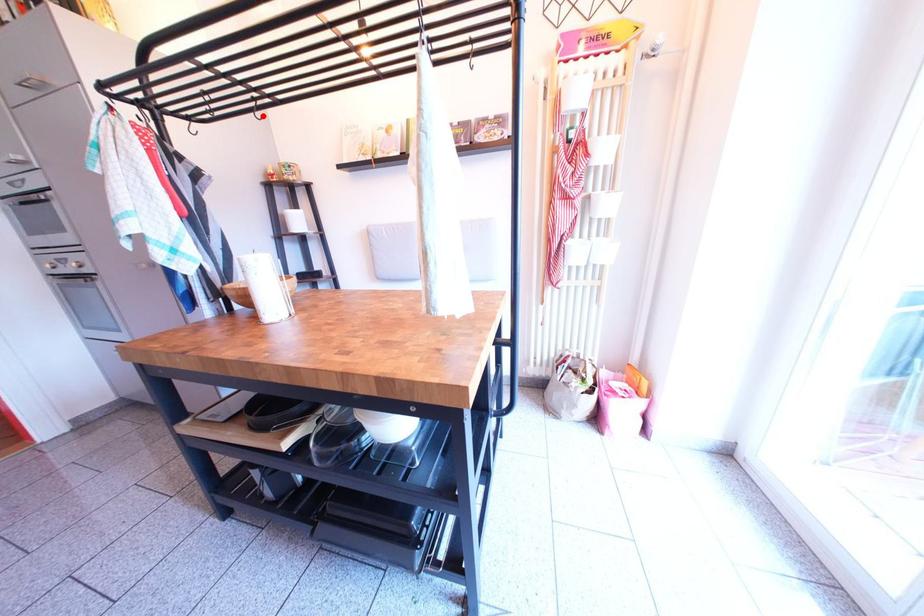
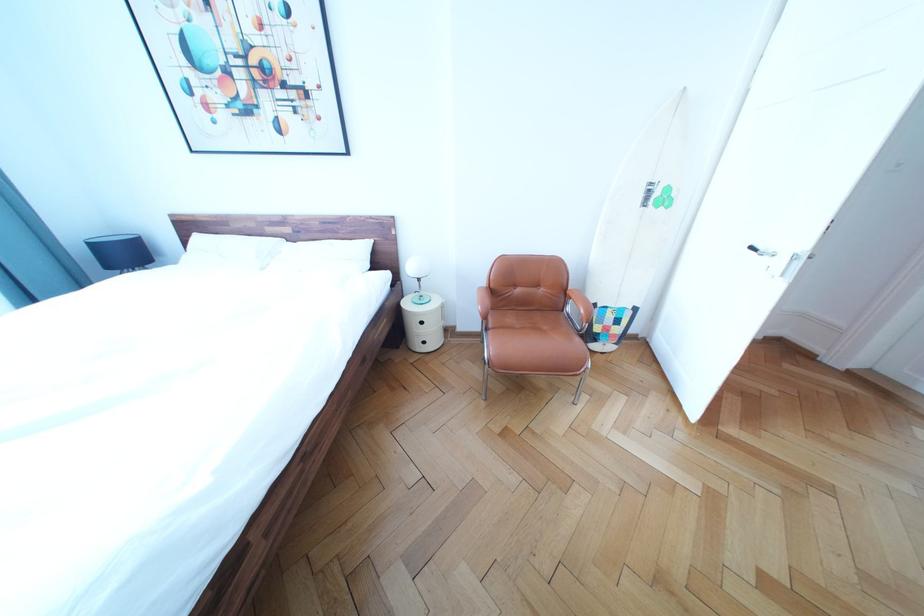
Question: I am providing you with two images of the same scene from different viewpoints. A red point is marked on the first image. Can you still see the location of the red point in image 2?

Choices:
 (A) Yes
 (B) No

Answer: (B)